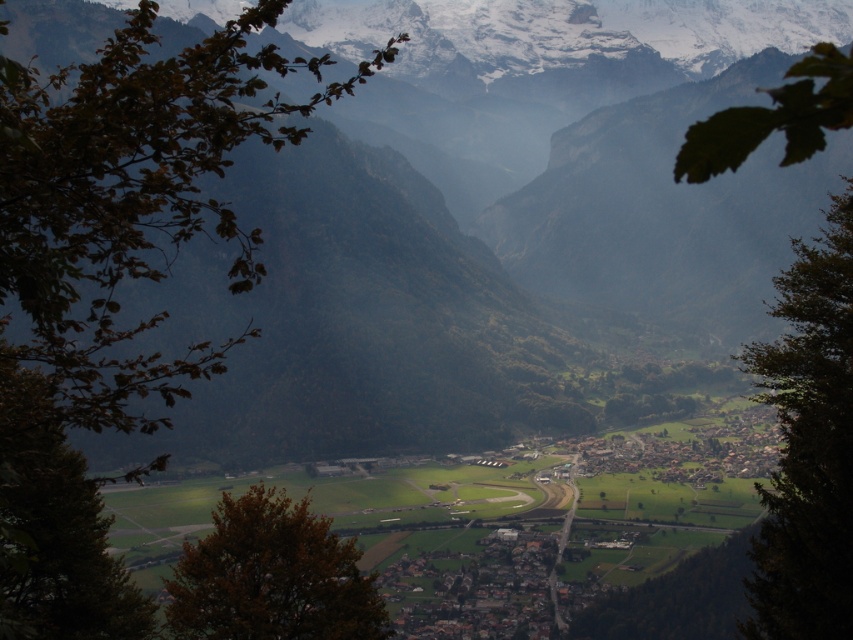
You are standing at the point labeled point [293,545] and want to walk to the point labeled point [697,611]. Which direction should you face to move towards your destination?

You should face towards the lower right direction because point [697,611] is further away from the viewer compared to point [293,545].

You are an environmental scientist assessing the biodiversity of this mountainous area. The green matte tree at left and brown leafy tree at center are both native species. Which tree is taller, and how might this affect their roles in the ecosystem?

The green matte tree at left is taller than the brown leafy tree at center. This height difference could mean the green matte tree at left provides more canopy cover, supports higher nesting areas for birds, and plays a greater role in intercepting rainfall, while the shorter brown leafy tree at center might contribute more to undergrowth habitats and soil stabilization.